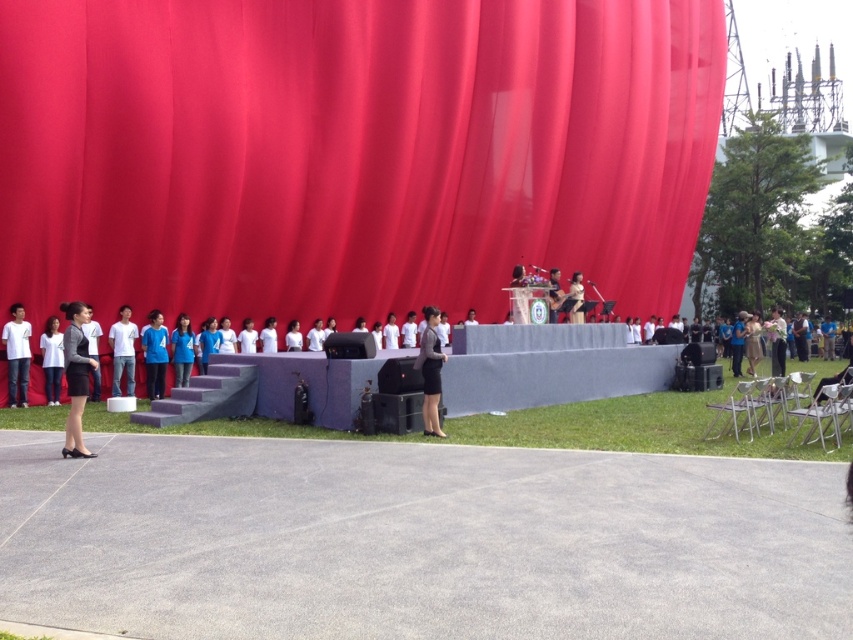
You are a photographer at the event. You want to take a photo of the white matte shirt at center. Where should you aim your camera to capture the subject?

The white matte shirt at center is located at point 0.548 on the horizontal axis and 0.144 on the vertical axis, so you should aim your camera at those coordinates to capture the subject.

Consider the image. You are standing at the point with coordinates [16,355] on the image. What object is located at that position?

The point [16,355] corresponds to the white cotton shirt at left.